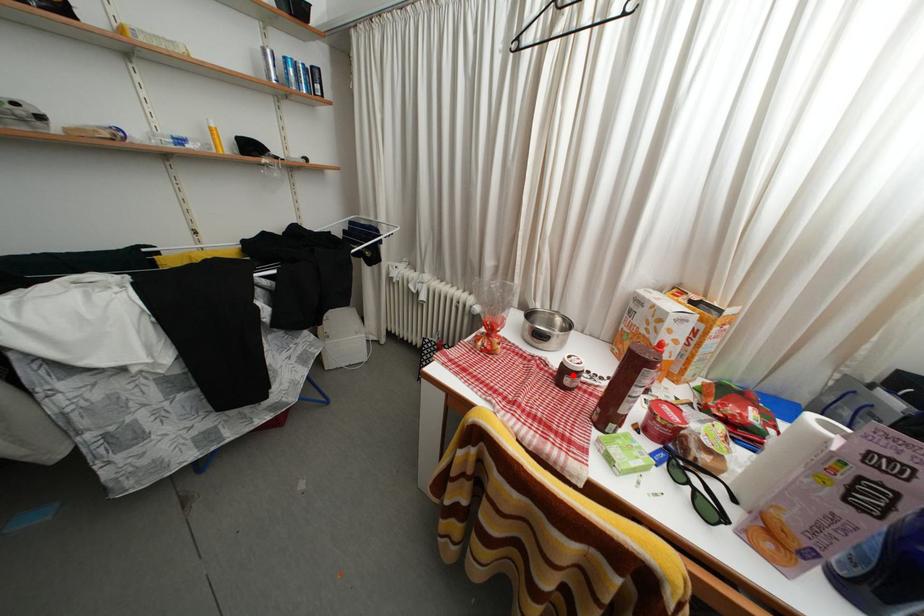
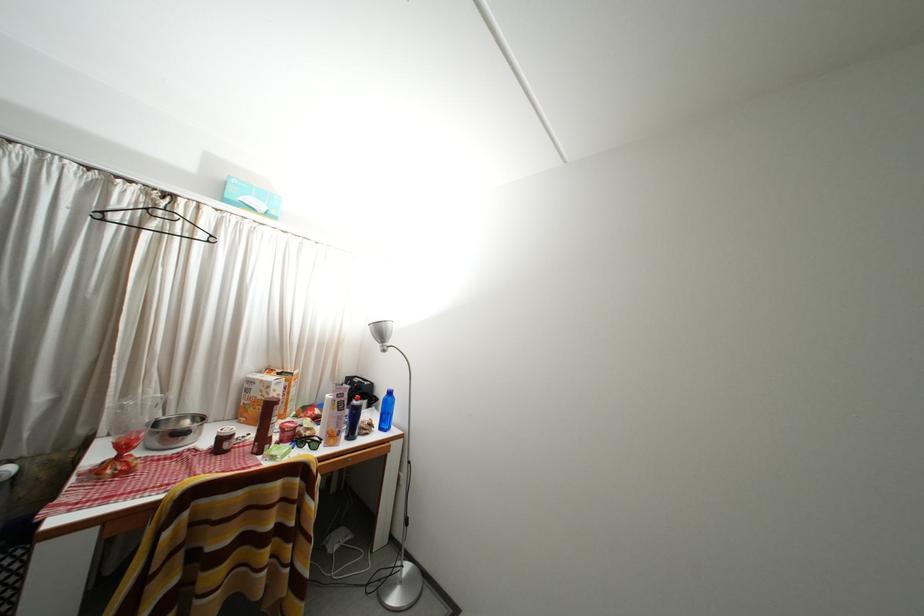
In the second image, find the point that corresponds to the highlighted location in the first image.

(229, 445)